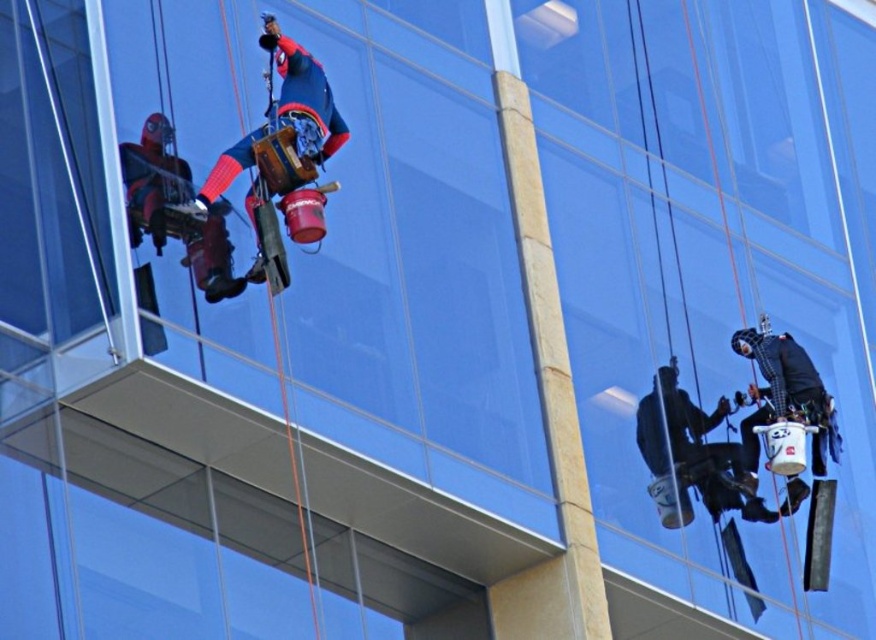
Between red fabric construction worker at upper left and black matte construction worker at lower right, which one is positioned lower?

black matte construction worker at lower right is lower down.

Does red fabric construction worker at upper left lie in front of black matte construction worker at lower right?

Yes, it is.

This screenshot has height=640, width=876. In order to click on red fabric construction worker at upper left in this screenshot , I will do `click(302, 96)`.